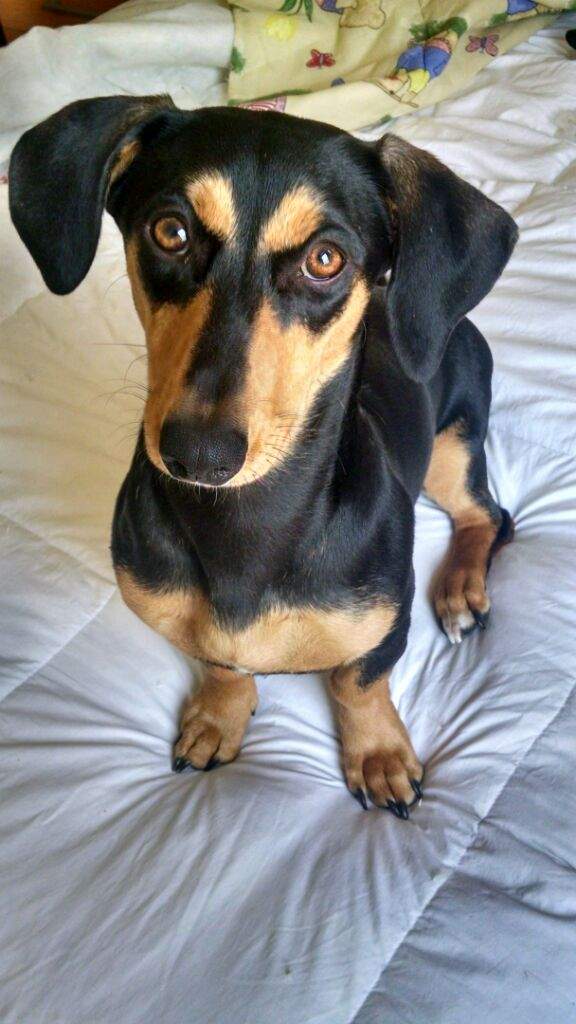
At what (x,y) coordinates should I click in order to perform the action: click on bed. Please return your answer as a coordinate pair (x, y). Looking at the image, I should click on (537, 694).